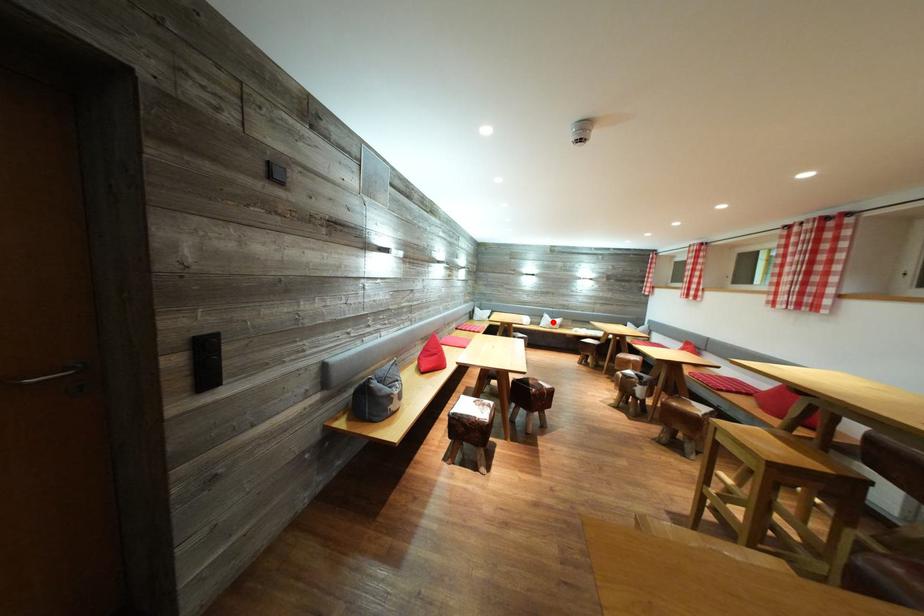
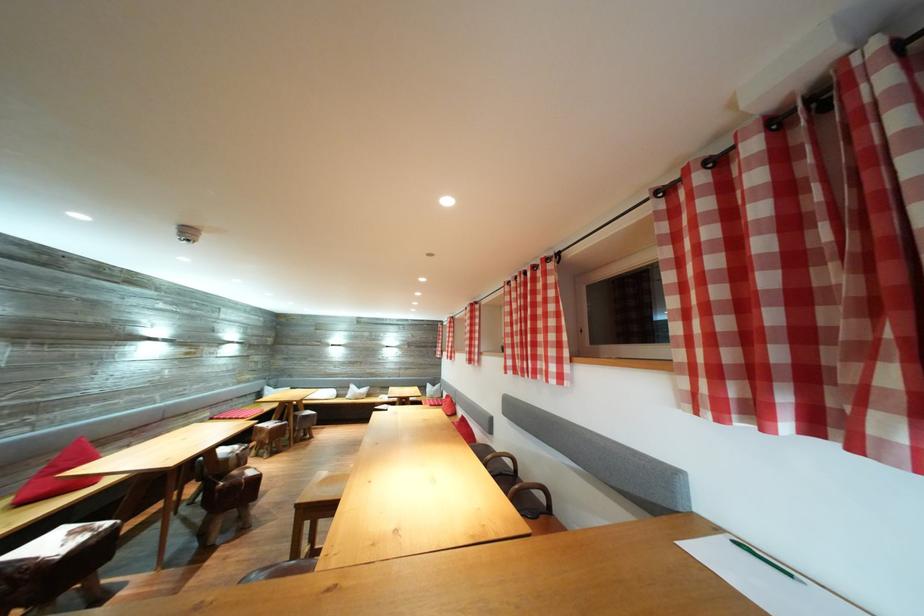
Question: I am providing you with two images of the same scene from different viewpoints. Image1 has a red point marked. In image2, the corresponding 3D location appears at what relative position? Reply with the corresponding letter.

Choices:
 (A) Closer
 (B) Farther

Answer: (B)